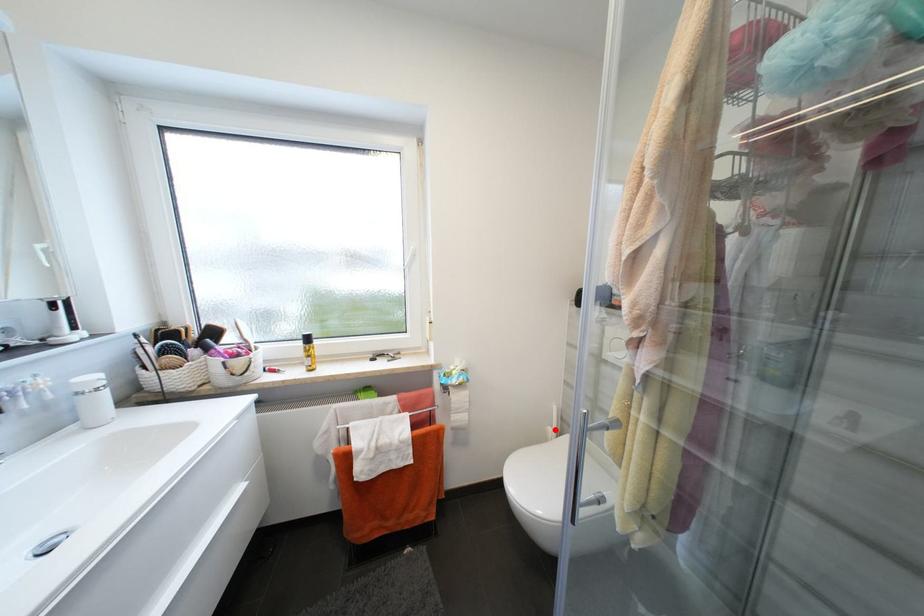
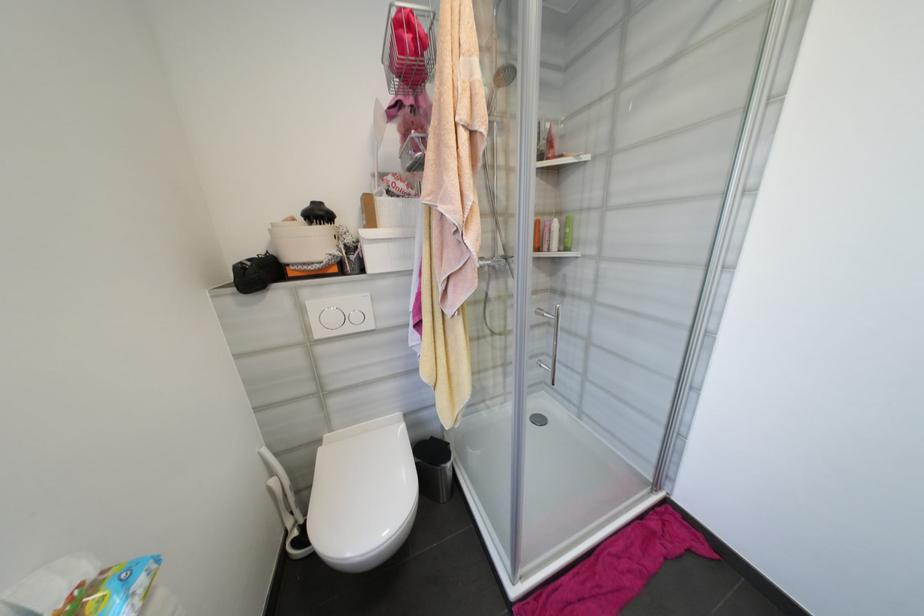
The point at the highlighted location is marked in the first image. Where is the corresponding point in the second image?

(277, 482)